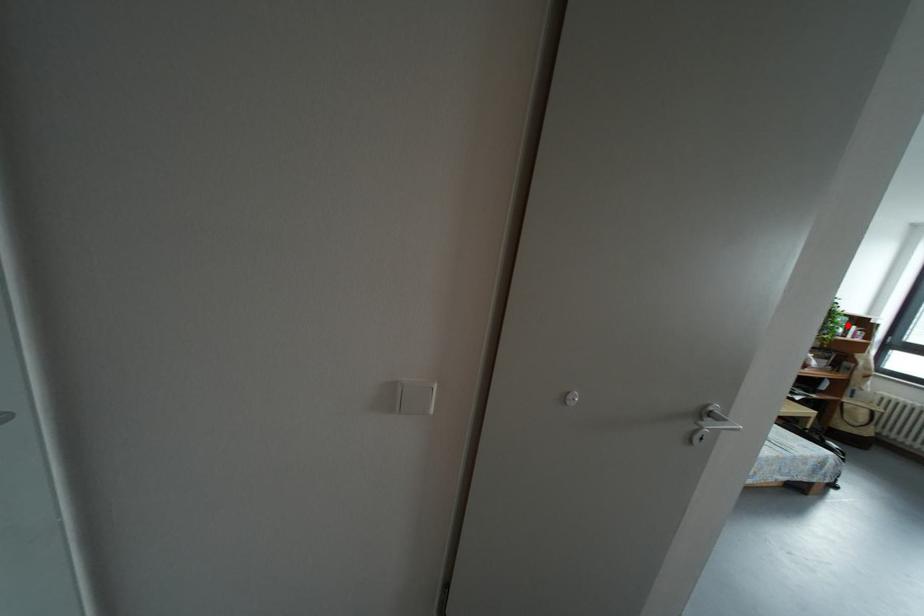
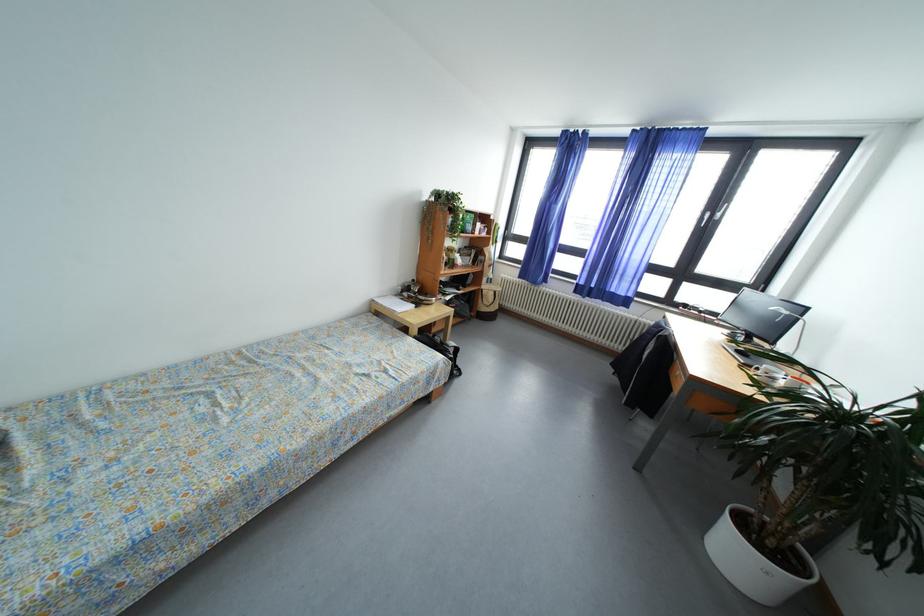
Where in the second image is the point corresponding to the highlighted location from the first image?

(477, 223)